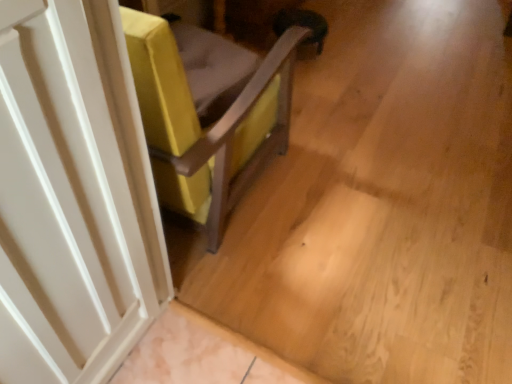
This screenshot has height=384, width=512. Find the location of `velvet yellow chair at center`. velvet yellow chair at center is located at coordinates (207, 121).

What do you see at coordinates (207, 121) in the screenshot? Image resolution: width=512 pixels, height=384 pixels. I see `velvet yellow chair at center` at bounding box center [207, 121].

You are a GUI agent. You are given a task and a screenshot of the screen. Output one action in this format:
    pyautogui.click(x=<x>, y=<y>)
    Task: Click on the white matte door at left
    This screenshot has height=384, width=512.
    Given the screenshot: What is the action you would take?
    pyautogui.click(x=73, y=196)

The height and width of the screenshot is (384, 512). What do you see at coordinates (73, 196) in the screenshot? I see `white matte door at left` at bounding box center [73, 196].

This screenshot has height=384, width=512. I want to click on velvet yellow chair at center, so click(x=207, y=121).

Considering the relative positions of velvet yellow chair at center and white matte door at left in the image provided, is velvet yellow chair at center to the left or to the right of white matte door at left?

In the image, velvet yellow chair at center appears on the right side of white matte door at left.

In the scene shown: Is velvet yellow chair at center in front of white matte door at left?

No, velvet yellow chair at center is further to the viewer.

Is point (169, 103) farther from camera compared to point (108, 252)?

Yes.

From the image's perspective, between velvet yellow chair at center and white matte door at left, who is located below?

From the image's view, white matte door at left is below.

From a real-world perspective, between velvet yellow chair at center and white matte door at left, who is vertically lower?

velvet yellow chair at center.

Is velvet yellow chair at center wider than white matte door at left?

Correct, the width of velvet yellow chair at center exceeds that of white matte door at left.

Is velvet yellow chair at center taller than white matte door at left?

No, velvet yellow chair at center is not taller than white matte door at left.

Is velvet yellow chair at center bigger than white matte door at left?

Yes, velvet yellow chair at center is bigger than white matte door at left.

Is velvet yellow chair at center situated inside white matte door at left or outside?

velvet yellow chair at center is not inside white matte door at left, it's outside.

Is velvet yellow chair at center far away from white matte door at left?

That's not correct — velvet yellow chair at center is a little close to white matte door at left.

Is velvet yellow chair at center facing towards white matte door at left?

No, velvet yellow chair at center is not aimed at white matte door at left.

How different are the orientations of velvet yellow chair at center and white matte door at left in degrees?

They differ by 90.5 degrees in their facing directions.

In the scene shown: How much distance is there between velvet yellow chair at center and white matte door at left?

velvet yellow chair at center is 17.30 inches away from white matte door at left.

Find the location of a particular element. Image resolution: width=512 pixels, height=384 pixels. door in front of the velvet yellow chair at center is located at coordinates (73, 196).

Which is more to the left, white matte door at left or velvet yellow chair at center?

Positioned to the left is white matte door at left.

Does white matte door at left come in front of velvet yellow chair at center?

Yes, the depth of white matte door at left is less than that of velvet yellow chair at center.

Which is farther from the camera, (80,339) or (186,176)?

The point (186,176) is farther.

Based on the photo, from the image's perspective, is white matte door at left above or below velvet yellow chair at center?

white matte door at left is situated lower than velvet yellow chair at center in the image.

Consider the image. From a real-world perspective, is white matte door at left physically above velvet yellow chair at center?

Yes, from a real-world perspective, white matte door at left is over velvet yellow chair at center

Between white matte door at left and velvet yellow chair at center, which one has smaller width?

white matte door at left.

Considering the relative sizes of white matte door at left and velvet yellow chair at center in the image provided, is white matte door at left taller than velvet yellow chair at center?

Indeed, white matte door at left has a greater height compared to velvet yellow chair at center.

Is white matte door at left bigger than velvet yellow chair at center?

Incorrect, white matte door at left is not larger than velvet yellow chair at center.

Is white matte door at left surrounding velvet yellow chair at center?

That's incorrect, velvet yellow chair at center is not inside white matte door at left.

Is white matte door at left not near velvet yellow chair at center?

No, white matte door at left is not far away from velvet yellow chair at center.

Is white matte door at left oriented towards velvet yellow chair at center?

No, white matte door at left is not oriented towards velvet yellow chair at center.

What's the angular difference between white matte door at left and velvet yellow chair at center's facing directions?

The angular difference between white matte door at left and velvet yellow chair at center is 90.5 degrees.

At what (x,y) coordinates should I click in order to perform the action: click on furniture on the right of the white matte door at left. Please return your answer as a coordinate pair (x, y). Looking at the image, I should click on (207, 121).

Where is `door above the velvet yellow chair at center (from a real-world perspective)`? Image resolution: width=512 pixels, height=384 pixels. door above the velvet yellow chair at center (from a real-world perspective) is located at coordinates (73, 196).

Locate an element on the screen. This screenshot has height=384, width=512. furniture lying above the white matte door at left (from the image's perspective) is located at coordinates (207, 121).